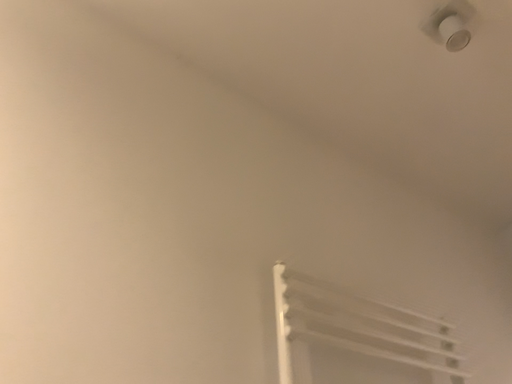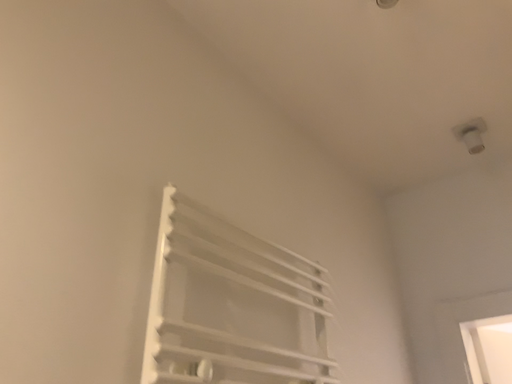
Question: Which way did the camera rotate in the video?

Choices:
 (A) rotated upward
 (B) rotated downward

Answer: (B)